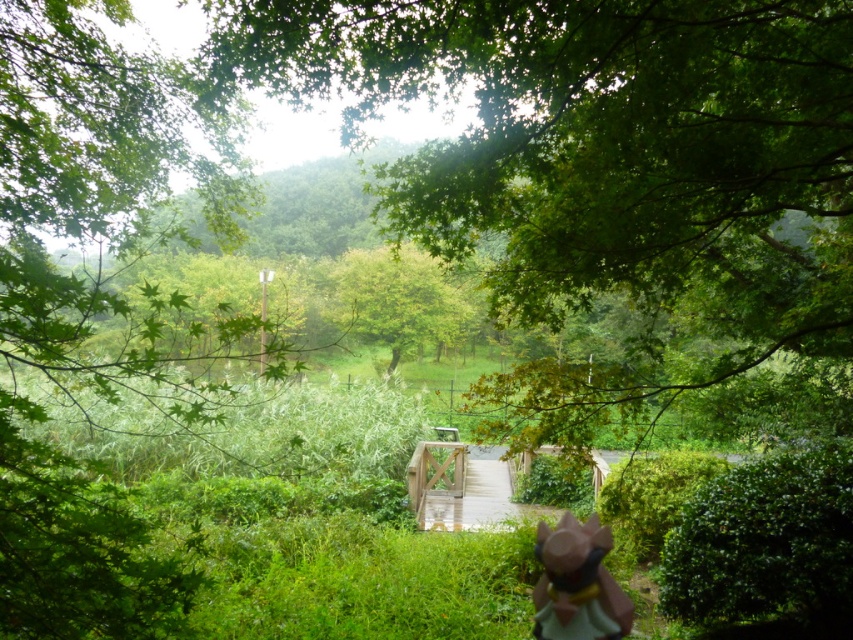
Question: Does green leafy tree at center have a smaller size compared to pink matte figurine at lower center?

Choices:
 (A) no
 (B) yes

Answer: (A)

Question: Which point is farther from the camera taking this photo?

Choices:
 (A) (572, 636)
 (B) (572, 396)

Answer: (B)

Question: Which point is closer to the camera taking this photo?

Choices:
 (A) click(x=428, y=243)
 (B) click(x=540, y=524)

Answer: (B)

Question: In this image, where is green leafy tree at center located relative to pink matte figurine at lower center?

Choices:
 (A) left
 (B) right

Answer: (B)

Question: Can you confirm if green leafy tree at center is wider than pink matte figurine at lower center?

Choices:
 (A) no
 (B) yes

Answer: (B)